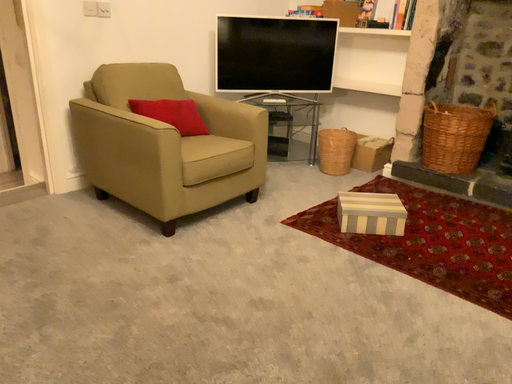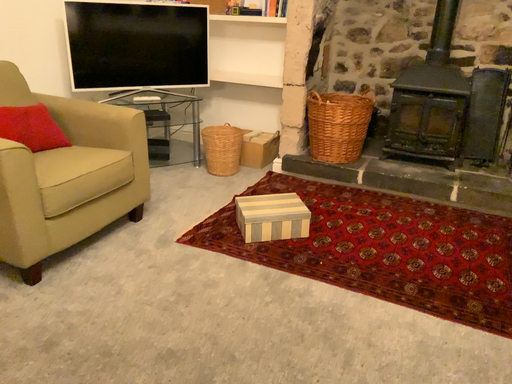
Question: Which way did the camera rotate in the video?

Choices:
 (A) rotated right
 (B) rotated left

Answer: (A)